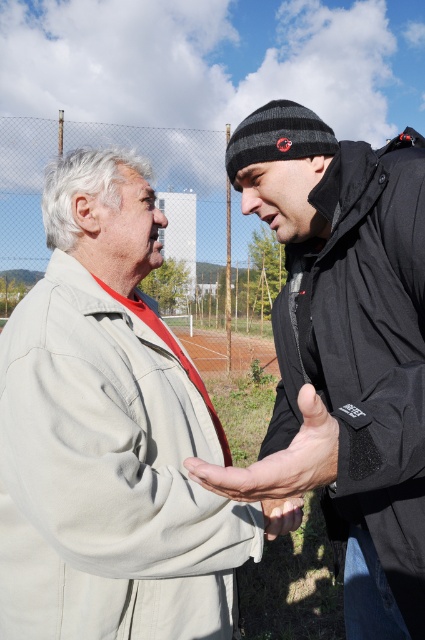
Question: Among these objects, which one is nearest to the camera?

Choices:
 (A) dry skin hand at center
 (B) black matte jacket at center
 (C) smooth skin hand at center
 (D) beige cotton jacket at center

Answer: (A)

Question: Which object appears closest to the camera in this image?

Choices:
 (A) beige cotton jacket at center
 (B) black matte jacket at center
 (C) dry skin hand at center

Answer: (C)

Question: Is black matte jacket at center closer to the viewer compared to dry skin hand at center?

Choices:
 (A) no
 (B) yes

Answer: (A)

Question: Is black matte jacket at center above smooth skin hand at center?

Choices:
 (A) no
 (B) yes

Answer: (B)

Question: Is black matte jacket at center positioned at the back of smooth skin hand at center?

Choices:
 (A) yes
 (B) no

Answer: (B)

Question: Which object is the farthest from the dry skin hand at center?

Choices:
 (A) beige cotton jacket at center
 (B) smooth skin hand at center

Answer: (A)